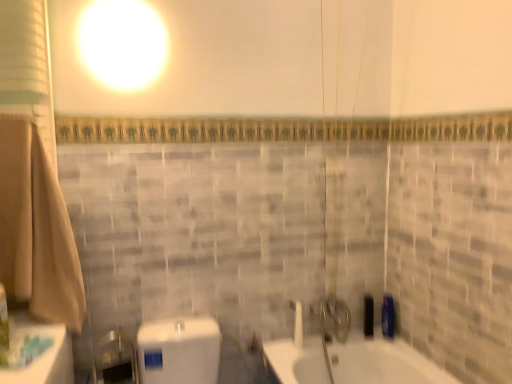
Question: Should I look upward or downward to see white glossy shower at center?

Choices:
 (A) down
 (B) up

Answer: (A)

Question: Does green plastic toothbrush at lower left, the third toiletry from the right, have a greater height compared to blue glossy bottle at right, which is counted as the 2th toiletry, starting from the front?

Choices:
 (A) no
 (B) yes

Answer: (B)

Question: Can you confirm if green plastic toothbrush at lower left, the third toiletry from the right, is positioned to the left of blue glossy bottle at right, placed as the first toiletry when sorted from right to left?

Choices:
 (A) yes
 (B) no

Answer: (A)

Question: From the image's perspective, is green plastic toothbrush at lower left, the third toiletry from the right, located beneath blue glossy bottle at right, placed as the first toiletry when sorted from right to left?

Choices:
 (A) no
 (B) yes

Answer: (A)

Question: Does green plastic toothbrush at lower left, marked as the 3th toiletry in a back-to-front arrangement, have a greater width compared to blue glossy bottle at right, placed as the first toiletry when sorted from right to left?

Choices:
 (A) yes
 (B) no

Answer: (B)

Question: Is the position of green plastic toothbrush at lower left, the third toiletry from the right, more distant than that of blue glossy bottle at right, the third toiletry positioned from the left?

Choices:
 (A) no
 (B) yes

Answer: (A)

Question: Would you consider green plastic toothbrush at lower left, marked as the 3th toiletry in a back-to-front arrangement, to be distant from blue glossy bottle at right, the third toiletry positioned from the left?

Choices:
 (A) no
 (B) yes

Answer: (B)

Question: Does blue glossy bottle at right, placed as the first toiletry when sorted from right to left, have a smaller size compared to beige cotton bath towel at left?

Choices:
 (A) no
 (B) yes

Answer: (B)

Question: Considering the relative sizes of blue glossy bottle at right, which is counted as the 2th toiletry, starting from the front, and beige cotton bath towel at left in the image provided, is blue glossy bottle at right, which is counted as the 2th toiletry, starting from the front, thinner than beige cotton bath towel at left?

Choices:
 (A) yes
 (B) no

Answer: (A)

Question: Does blue glossy bottle at right, the third toiletry positioned from the left, contain beige cotton bath towel at left?

Choices:
 (A) yes
 (B) no

Answer: (B)

Question: Does blue glossy bottle at right, acting as the second toiletry starting from the back, have a greater height compared to beige cotton bath towel at left?

Choices:
 (A) yes
 (B) no

Answer: (B)

Question: Does blue glossy bottle at right, the third toiletry positioned from the left, appear on the left side of beige cotton bath towel at left?

Choices:
 (A) no
 (B) yes

Answer: (A)

Question: Is blue glossy bottle at right, which is counted as the 2th toiletry, starting from the front, located outside beige cotton bath towel at left?

Choices:
 (A) yes
 (B) no

Answer: (A)

Question: Is green plastic toothbrush at lower left, the 1th toiletry from the front, facing towards beige cotton bath towel at left?

Choices:
 (A) yes
 (B) no

Answer: (B)